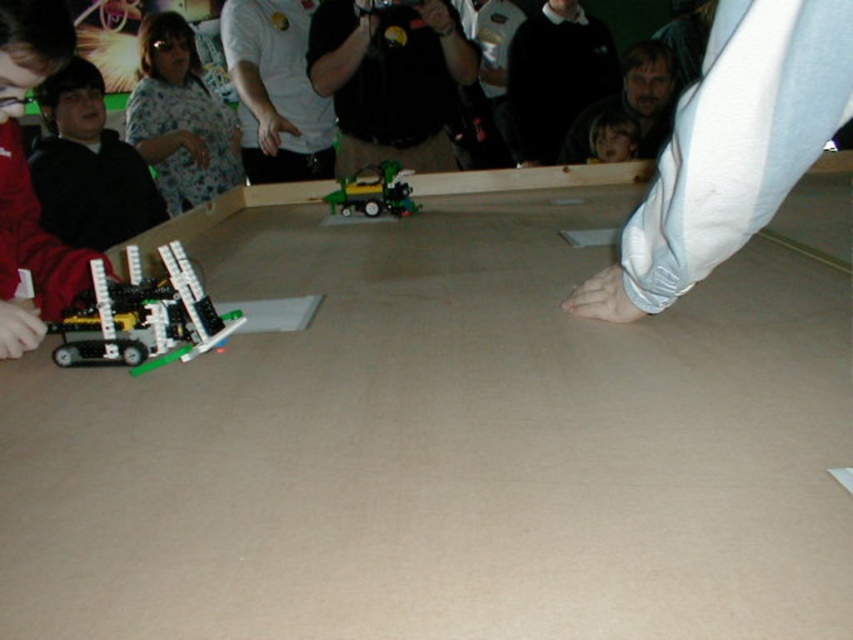
You are a participant in the robotics competition and need to locate the black plastic camera at center and the floral shirt at upper left. From your perspective standing at the edge of the playing area, which object is positioned higher?

The floral shirt at upper left is positioned higher than the black plastic camera at center since the camera is below the shirt.

You are a judge in a robotics competition. You need to determine if the translucent plastic robot at lower left can fit through a doorway that is the same width as the white fabric foot at center. Can it fit?

The translucent plastic robot at lower left might be wider than white fabric foot at center, so it might not fit through the doorway.